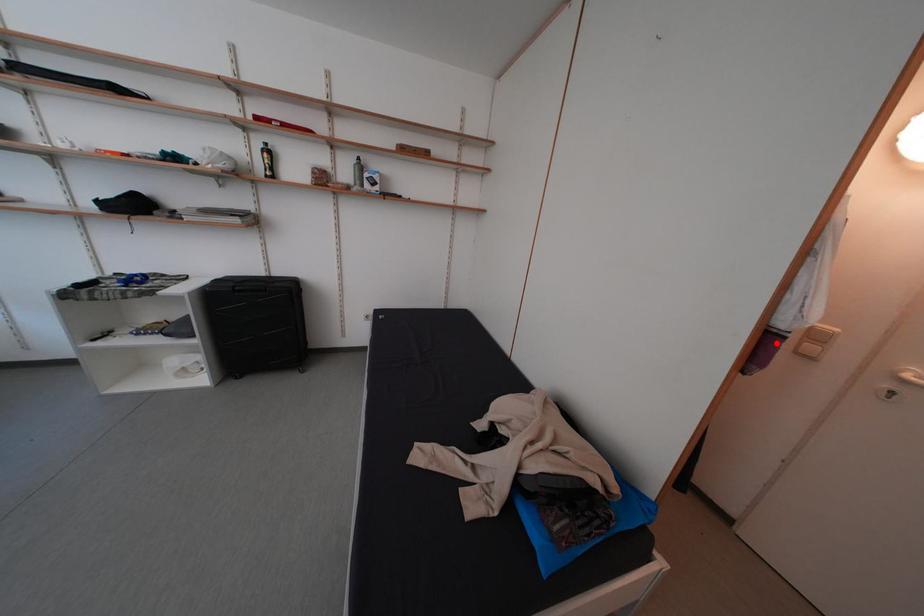
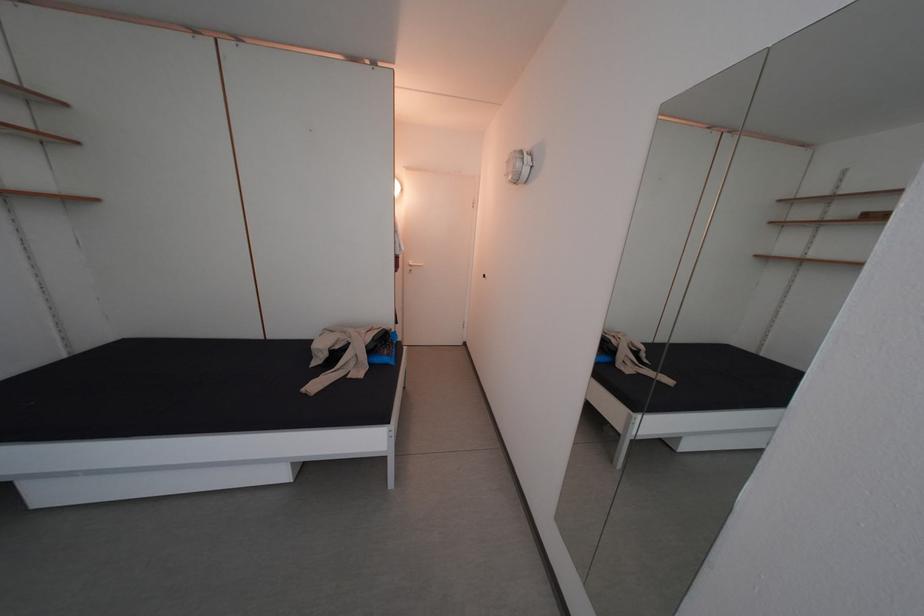
Question: I am providing you with two images of the same scene from different viewpoints. Given a red point in image1, look at the same physical point in image2. Is it:

Choices:
 (A) Closer to the viewpoint
 (B) Farther from the viewpoint

Answer: (A)